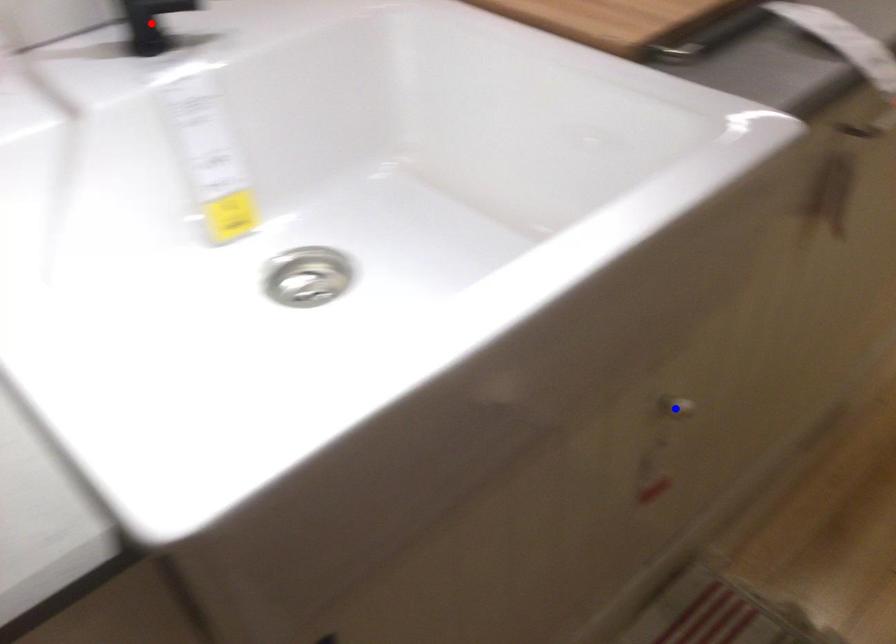
Question: Which of the two points in the image is closer to the camera?

Choices:
 (A) Blue point is closer.
 (B) Red point is closer.

Answer: (B)